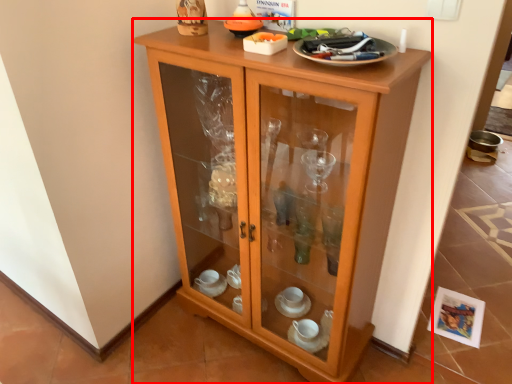
Question: From the image's perspective, what is the correct spatial relationship of cupboard (annotated by the red box) in relation to tableware?

Choices:
 (A) below
 (B) above

Answer: (A)